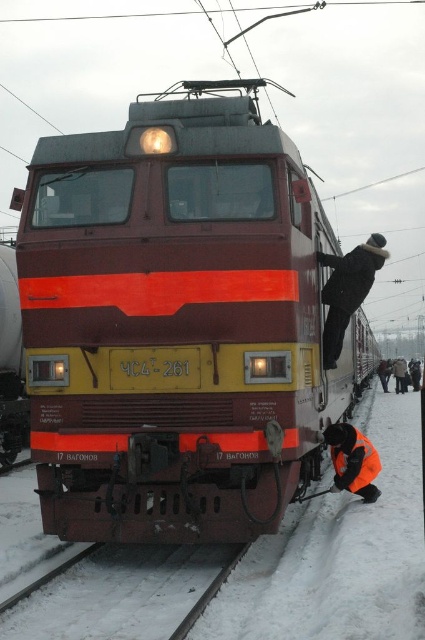
You are standing at the railway station depicted in the image. You notice a point marked at coordinates (348, 289). What object is located at this point?

The point at coordinates (348, 289) corresponds to the black fuzzy hat at upper center.

You are standing at the railway station and want to determine which of the two points, point (130, 595) or point (363, 442), is nearer to you. Based on the scene description, which point is closer?

Point (130, 595) is closer to the viewer than point (363, 442).